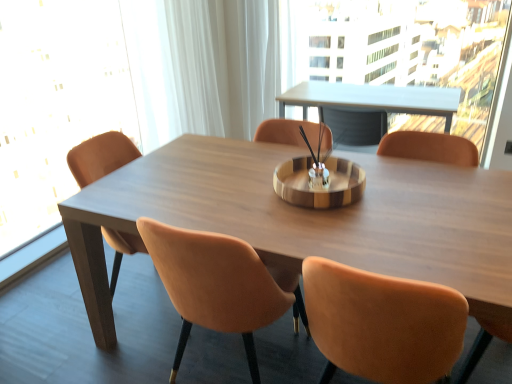
Question: Is point (119, 97) closer or farther from the camera than point (81, 274)?

Choices:
 (A) closer
 (B) farther

Answer: (B)

Question: From a real-world perspective, relative to wooden table at center, is transparent glass window screen at left vertically above or below?

Choices:
 (A) above
 (B) below

Answer: (A)

Question: Which object is positioned closest to the wooden table at center?

Choices:
 (A) transparent glass window screen at left
 (B) matte brown chair at center

Answer: (B)

Question: Which of these objects is positioned closest to the wooden table at center?

Choices:
 (A) matte brown chair at center
 (B) transparent glass window screen at left

Answer: (A)